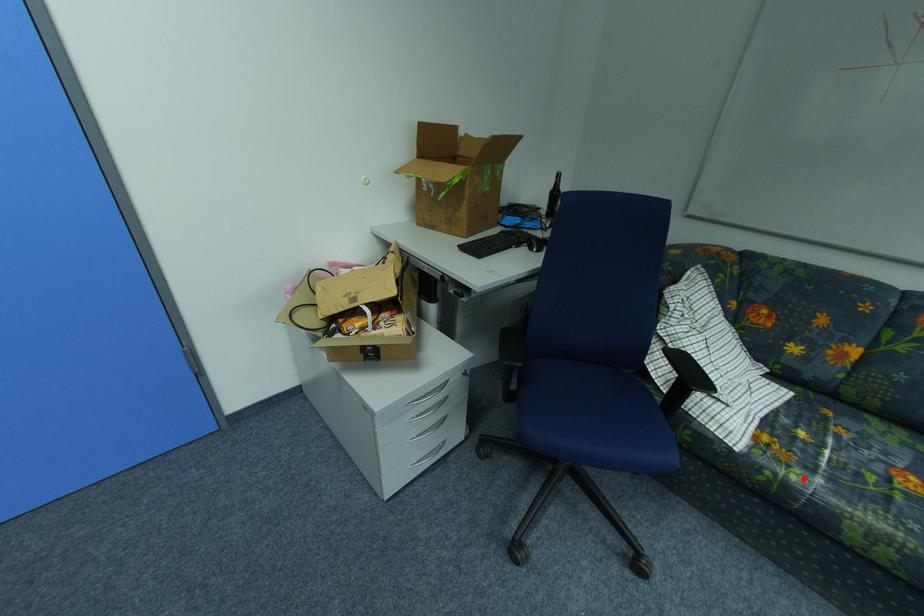
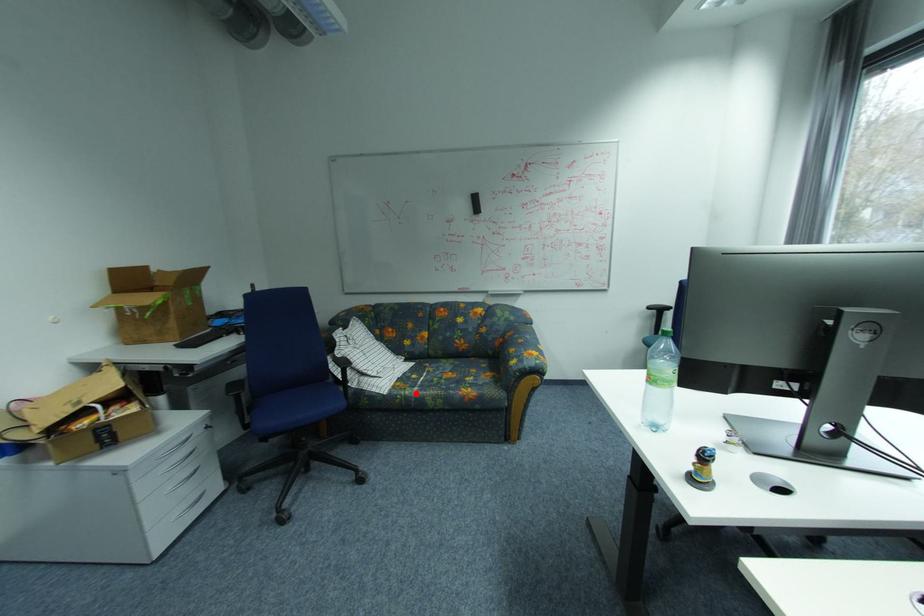
I am providing you with two images of the same scene from different viewpoints. A red point is marked on the first image and another point is marked on the second image. Does the point marked in image1 correspond to the same location as the one in image2?

Yes